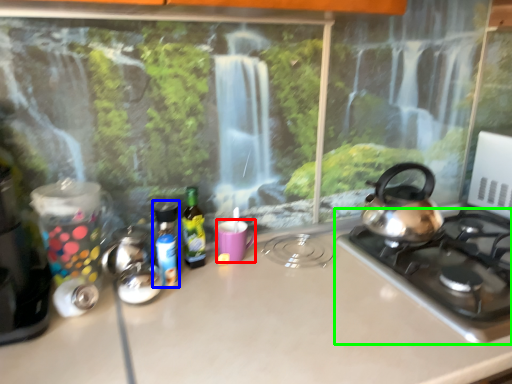
Question: Considering the real-world distances, which object is farthest from mug (highlighted by a red box)? bottle (highlighted by a blue box) or gas stove (highlighted by a green box)?

Choices:
 (A) bottle
 (B) gas stove

Answer: (B)